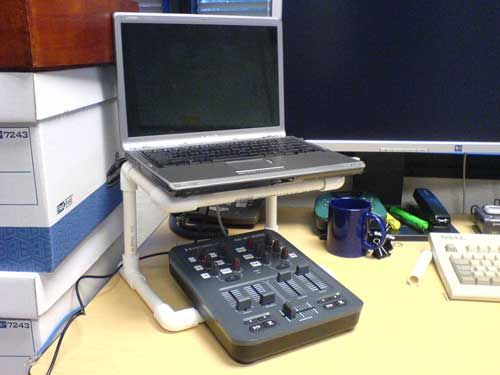
Where is `keyboard`? The image size is (500, 375). keyboard is located at coordinates (479, 263), (234, 146).